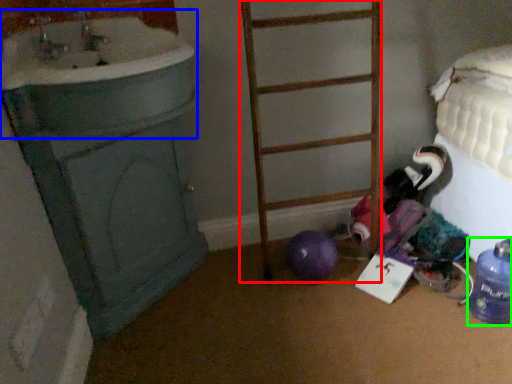
Question: Considering the real-world distances, which object is farthest from ladder (highlighted by a red box)? sink (highlighted by a blue box) or bottle (highlighted by a green box)?

Choices:
 (A) sink
 (B) bottle

Answer: (B)